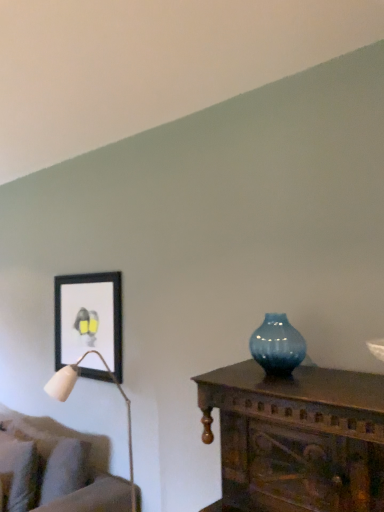
At what (x,y) coordinates should I click in order to perform the action: click on velvet beige couch at lower left. Please return your answer as a coordinate pair (x, y). Looking at the image, I should click on (52, 474).

The image size is (384, 512). What do you see at coordinates (88, 318) in the screenshot?
I see `black matte picture frame at upper left` at bounding box center [88, 318].

Where is `velvet beige couch at lower left`? velvet beige couch at lower left is located at coordinates (52, 474).

Is blue glass vase at center situated inside black matte picture frame at upper left or outside?

blue glass vase at center is spatially situated outside black matte picture frame at upper left.

Can you confirm if blue glass vase at center is wider than black matte picture frame at upper left?

Correct, the width of blue glass vase at center exceeds that of black matte picture frame at upper left.

Are blue glass vase at center and black matte picture frame at upper left making contact?

No, blue glass vase at center is not making contact with black matte picture frame at upper left.

Consider the image. Which of these two, blue glass vase at center or black matte picture frame at upper left, stands taller?

With more height is black matte picture frame at upper left.

Which object is thinner, black matte picture frame at upper left or blue glass vase at center?

Thinner between the two is black matte picture frame at upper left.

Identify the location of vase on the right side of black matte picture frame at upper left. The height and width of the screenshot is (512, 384). (277, 345).

Is the depth of black matte picture frame at upper left greater than that of blue glass vase at center?

Yes, black matte picture frame at upper left is behind blue glass vase at center.

Is black matte picture frame at upper left aimed at blue glass vase at center?

No, black matte picture frame at upper left does not turn towards blue glass vase at center.

Looking at this image, considering the relative positions of velvet beige couch at lower left and black matte picture frame at upper left in the image provided, is velvet beige couch at lower left to the right of black matte picture frame at upper left from the viewer's perspective?

Incorrect, velvet beige couch at lower left is not on the right side of black matte picture frame at upper left.

Which object is further away from the camera, velvet beige couch at lower left or black matte picture frame at upper left?

black matte picture frame at upper left.

Looking at this image, does velvet beige couch at lower left have a larger size compared to black matte picture frame at upper left?

Yes, velvet beige couch at lower left is bigger than black matte picture frame at upper left.

Looking at this image, is black matte picture frame at upper left facing away from velvet beige couch at lower left?

No, black matte picture frame at upper left is not facing the opposite direction of velvet beige couch at lower left.

Looking at this image, does black matte picture frame at upper left touch velvet beige couch at lower left?

There is a gap between black matte picture frame at upper left and velvet beige couch at lower left.

Is black matte picture frame at upper left positioned before velvet beige couch at lower left?

No, it is not.

Is blue glass vase at center looking in the opposite direction of velvet beige couch at lower left?

That's not correct — blue glass vase at center is not looking away from velvet beige couch at lower left.

Which is behind, blue glass vase at center or velvet beige couch at lower left?

velvet beige couch at lower left is further from the camera.

Looking at the image, does blue glass vase at center seem bigger or smaller compared to velvet beige couch at lower left?

blue glass vase at center is smaller than velvet beige couch at lower left.

Is velvet beige couch at lower left inside blue glass vase at center?

Actually, velvet beige couch at lower left is outside blue glass vase at center.

Which of these two, velvet beige couch at lower left or blue glass vase at center, stands shorter?

blue glass vase at center is shorter.

In the scene shown: Which object is positioned more to the right, velvet beige couch at lower left or blue glass vase at center?

blue glass vase at center.

Would you consider velvet beige couch at lower left to be distant from blue glass vase at center?

Yes.

Is point (30, 432) positioned in front of point (274, 374)?

No.

The width and height of the screenshot is (384, 512). I want to click on picture frame below the blue glass vase at center (from a real-world perspective), so click(x=88, y=318).

The width and height of the screenshot is (384, 512). Find the location of `picture frame lying below the blue glass vase at center (from the image's perspective)`. picture frame lying below the blue glass vase at center (from the image's perspective) is located at coordinates (88, 318).

From the image, which object appears to be farther from black matte picture frame at upper left, blue glass vase at center or velvet beige couch at lower left?

The object further to black matte picture frame at upper left is blue glass vase at center.

Based on their spatial positions, is black matte picture frame at upper left or blue glass vase at center further from velvet beige couch at lower left?

blue glass vase at center is further to velvet beige couch at lower left.

Considering their positions, is blue glass vase at center positioned further to velvet beige couch at lower left than black matte picture frame at upper left?

Among the two, blue glass vase at center is located further to velvet beige couch at lower left.

Looking at the image, which one is located closer to black matte picture frame at upper left, velvet beige couch at lower left or blue glass vase at center?

velvet beige couch at lower left.

Looking at the image, which one is located further to blue glass vase at center, velvet beige couch at lower left or black matte picture frame at upper left?

velvet beige couch at lower left is further to blue glass vase at center.

From the picture: From the image, which object appears to be nearer to blue glass vase at center, black matte picture frame at upper left or velvet beige couch at lower left?

Based on the image, black matte picture frame at upper left appears to be nearer to blue glass vase at center.

I want to click on picture frame located between velvet beige couch at lower left and blue glass vase at center in the left-right direction, so click(x=88, y=318).